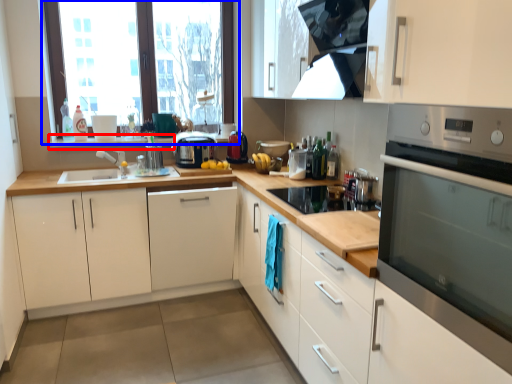
Question: Which point is further to the camera, window sill (highlighted by a red box) or window (highlighted by a blue box)?

Choices:
 (A) window sill
 (B) window

Answer: (A)